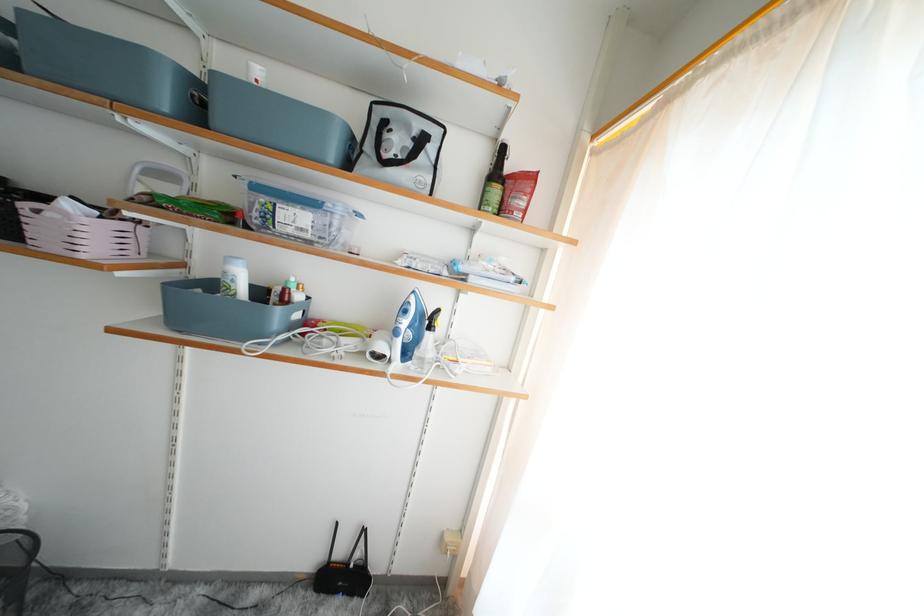
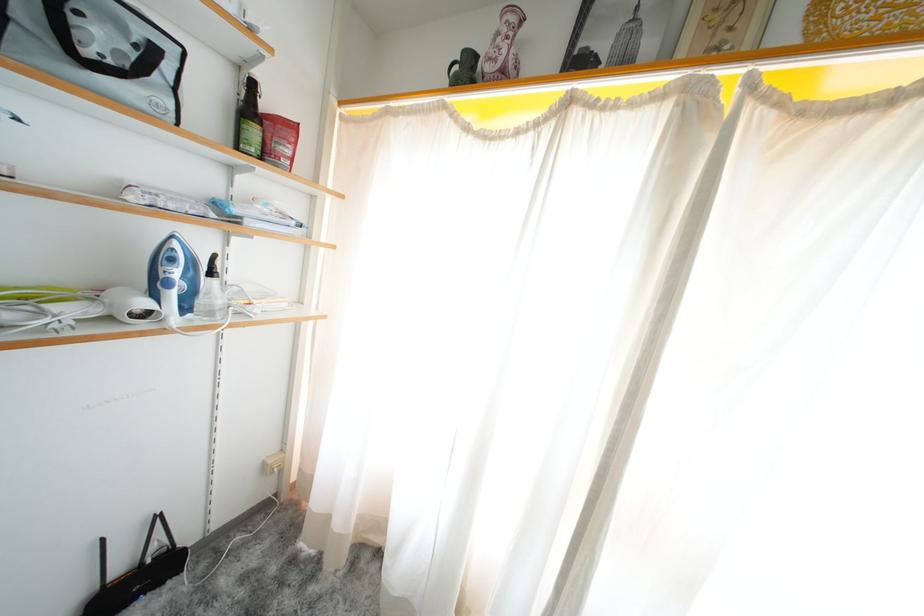
Find the pixel in the second image that matches point 436,331 in the first image.

(217, 278)